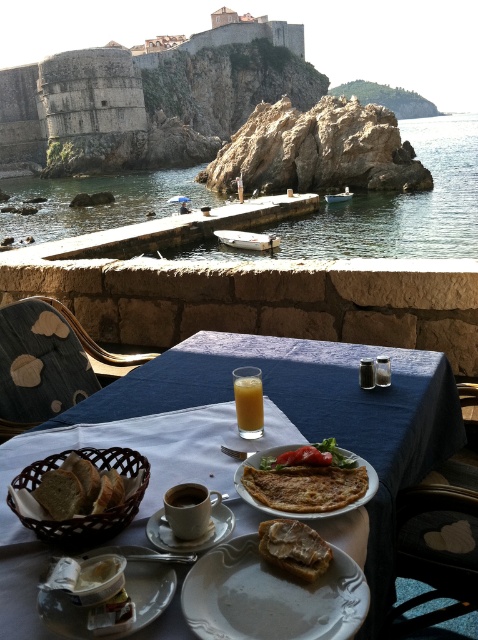
You are setting up a small decorative item that is 12 inches wide. You want to place it on the table near the white ceramic plate at center and the denim fabric chair at left. Considering their widths, which object should you place it next to to ensure it fits?

The white ceramic plate at center has a smaller width than the denim fabric chair at left, so placing the decorative item next to the white ceramic plate at center would provide enough space since the plate is narrower.